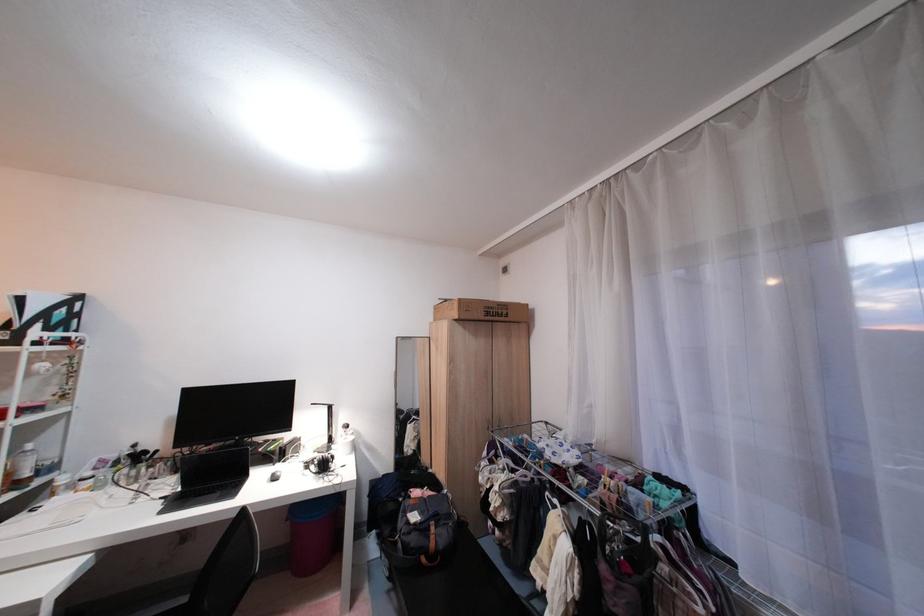
What do you see at coordinates (326, 426) in the screenshot? I see `the black desk lamp` at bounding box center [326, 426].